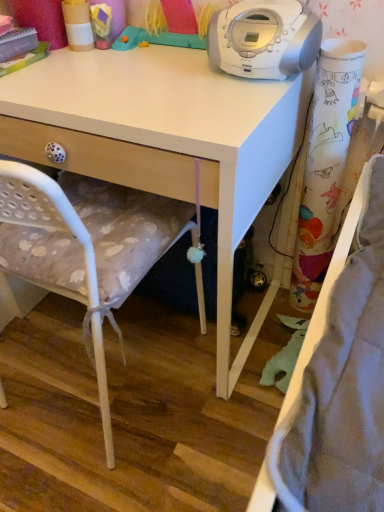
Find the location of `free location to the left of white plastic stereo at upper center`. free location to the left of white plastic stereo at upper center is located at coordinates (160, 82).